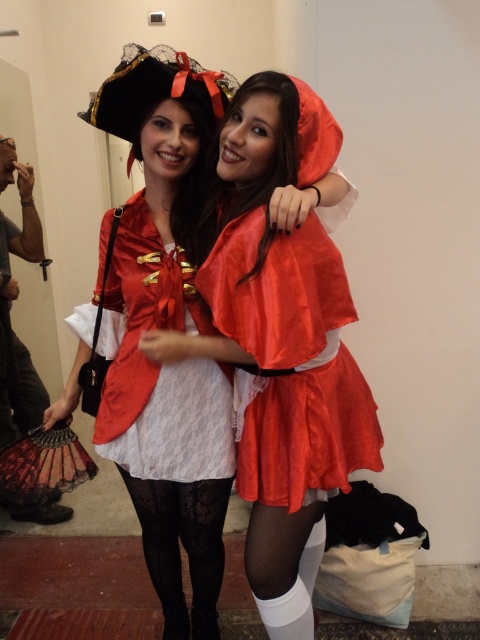
The width and height of the screenshot is (480, 640). What do you see at coordinates (162, 328) in the screenshot?
I see `satin red dress at center` at bounding box center [162, 328].

Can you confirm if satin red dress at center is positioned below black lace tights at lower center?

Actually, satin red dress at center is above black lace tights at lower center.

Image resolution: width=480 pixels, height=640 pixels. I want to click on satin red dress at center, so click(162, 328).

Looking at this image, between shiny satin cape at center and black lace tights at lower center, which one appears on the right side from the viewer's perspective?

From the viewer's perspective, shiny satin cape at center appears more on the right side.

Does shiny satin cape at center appear under black lace tights at lower center?

No, shiny satin cape at center is not below black lace tights at lower center.

At what (x,y) coordinates should I click in order to perform the action: click on shiny satin cape at center. Please return your answer as a coordinate pair (x, y). Looking at the image, I should click on (280, 340).

Can you confirm if shiny satin cape at center is positioned above satin red dress at center?

Yes, shiny satin cape at center is above satin red dress at center.

Is shiny satin cape at center below satin red dress at center?

No, shiny satin cape at center is not below satin red dress at center.

Does point (296, 353) come in front of point (148, 144)?

Yes.

In order to click on shiny satin cape at center in this screenshot , I will do `click(280, 340)`.